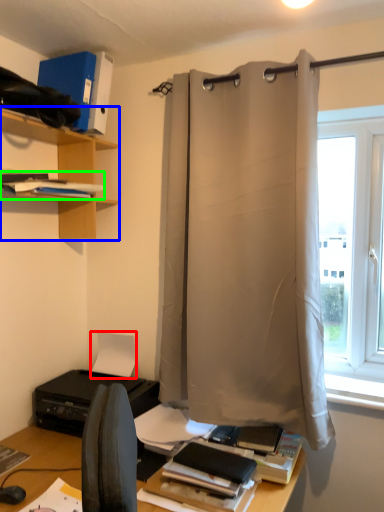
Question: Considering the real-world distances, which object is farthest from paper (highlighted by a red box)? shelf (highlighted by a blue box) or book (highlighted by a green box)?

Choices:
 (A) shelf
 (B) book

Answer: (B)